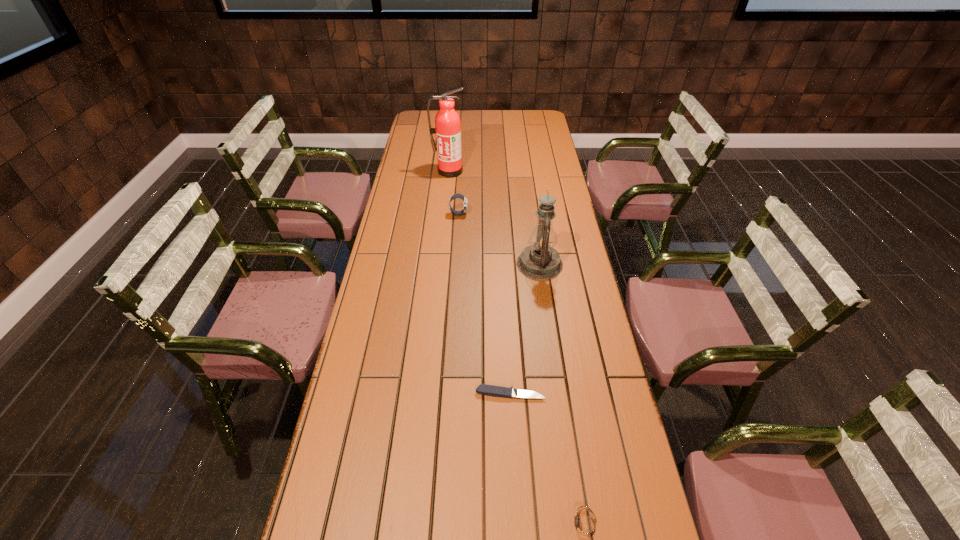
Find the location of a particular element. This screenshot has height=540, width=960. vacant space located 0.280m on the face of the fourth nearest object is located at coordinates (537, 214).

I want to click on free space located on the back of the steak knife, so click(x=508, y=345).

Where is `object present at the left edge`? The width and height of the screenshot is (960, 540). object present at the left edge is located at coordinates pyautogui.click(x=447, y=128).

Where is `object located at the right edge`? object located at the right edge is located at coordinates (540, 261).

This screenshot has height=540, width=960. Find the location of `free space at the far edge of the desktop`. free space at the far edge of the desktop is located at coordinates (484, 111).

Locate an element on the screen. vacant space at the left edge is located at coordinates (359, 517).

Image resolution: width=960 pixels, height=540 pixels. What are the coordinates of `vacant position at the right edge of the desktop` in the screenshot? It's located at (601, 430).

I want to click on empty location between the taller watch and the farthest object, so click(x=454, y=193).

The image size is (960, 540). In order to click on blank region between the third farthest object and the shortest object in this screenshot , I will do `click(525, 328)`.

I want to click on free spot between the fire extinguisher and the fourth farthest object, so click(480, 282).